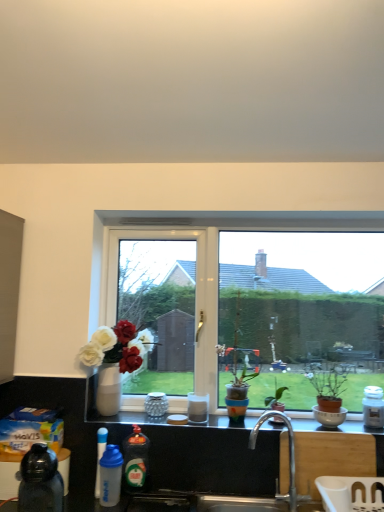
Question: Is silver metallic faucet at center to the right of white glossy window at center from the viewer's perspective?

Choices:
 (A) no
 (B) yes

Answer: (B)

Question: Does silver metallic faucet at center have a larger size compared to white glossy window at center?

Choices:
 (A) no
 (B) yes

Answer: (A)

Question: Does silver metallic faucet at center have a lesser width compared to white glossy window at center?

Choices:
 (A) no
 (B) yes

Answer: (A)

Question: Is silver metallic faucet at center wider than white glossy window at center?

Choices:
 (A) yes
 (B) no

Answer: (A)

Question: From a real-world perspective, is silver metallic faucet at center located higher than white glossy window at center?

Choices:
 (A) no
 (B) yes

Answer: (A)

Question: Does silver metallic faucet at center contain white glossy window at center?

Choices:
 (A) no
 (B) yes

Answer: (A)

Question: From a real-world perspective, is multicolored terracotta pot at center, the first houseplant when ordered from left to right, under silver metallic faucet at center?

Choices:
 (A) yes
 (B) no

Answer: (B)

Question: Does multicolored terracotta pot at center, the first houseplant when ordered from left to right, have a greater height compared to silver metallic faucet at center?

Choices:
 (A) yes
 (B) no

Answer: (A)

Question: Is multicolored terracotta pot at center, the first houseplant when ordered from left to right, with silver metallic faucet at center?

Choices:
 (A) yes
 (B) no

Answer: (B)

Question: Is the position of multicolored terracotta pot at center, the first houseplant when ordered from left to right, less distant than that of silver metallic faucet at center?

Choices:
 (A) no
 (B) yes

Answer: (A)

Question: Considering the relative sizes of multicolored terracotta pot at center, positioned as the second houseplant in right-to-left order, and silver metallic faucet at center in the image provided, is multicolored terracotta pot at center, positioned as the second houseplant in right-to-left order, smaller than silver metallic faucet at center?

Choices:
 (A) yes
 (B) no

Answer: (B)

Question: Are multicolored terracotta pot at center, the first houseplant when ordered from left to right, and silver metallic faucet at center located far from each other?

Choices:
 (A) no
 (B) yes

Answer: (A)

Question: Does white glossy coffee cup at center, the 2th coffee cup viewed from the back, have a greater width compared to white matte jar at right, which appears as the first bottle when viewed from the right?

Choices:
 (A) no
 (B) yes

Answer: (A)